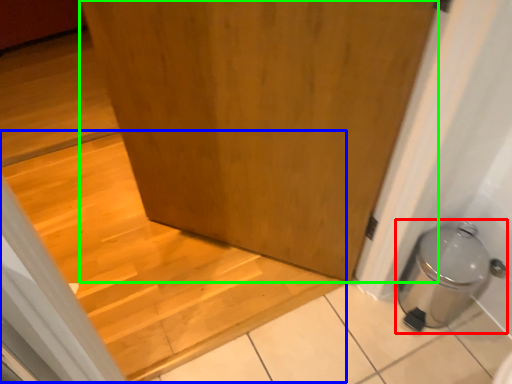
Question: Considering the real-world distances, which object is closest to water heater (highlighted by a red box)? stairwell (highlighted by a blue box) or door (highlighted by a green box).

Choices:
 (A) stairwell
 (B) door

Answer: (B)